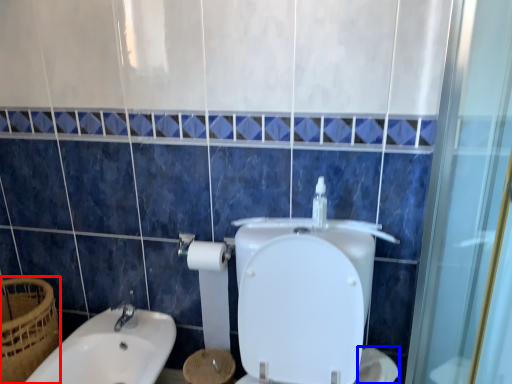
Question: Which object is closer to the camera taking this photo, basket (highlighted by a red box) or toilet paper (highlighted by a blue box)?

Choices:
 (A) basket
 (B) toilet paper

Answer: (B)